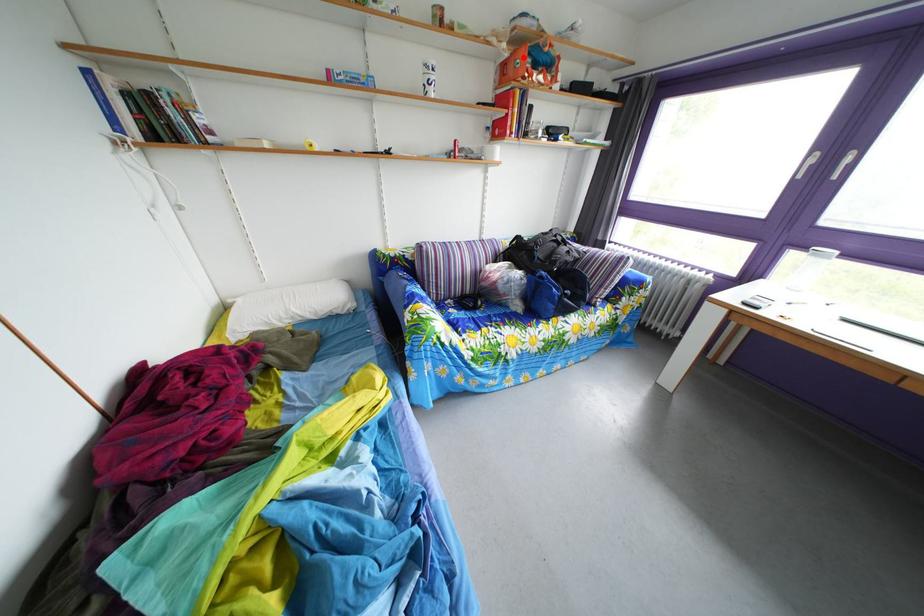
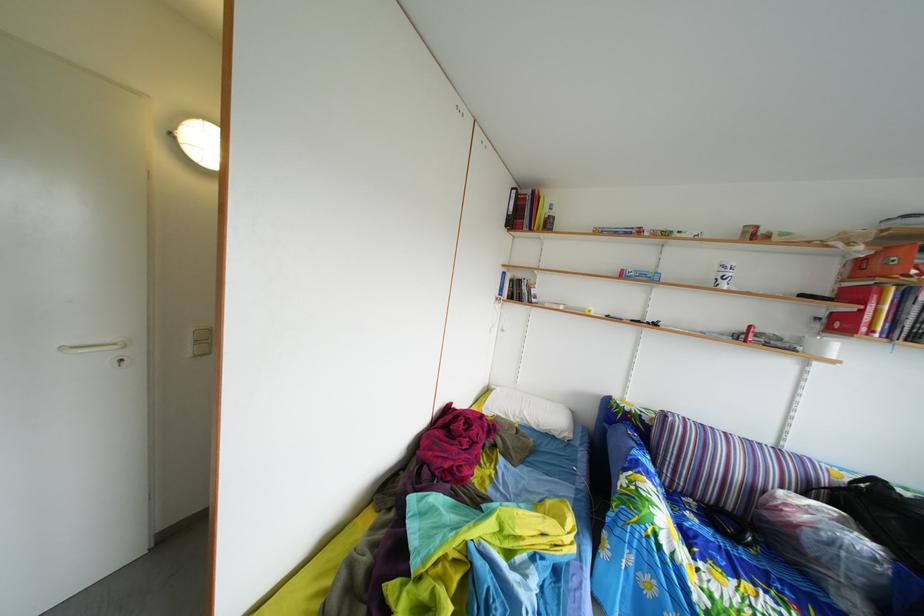
Question: I am providing you with two images of the same scene from different viewpoints. A red point is shown in image1. For the corresponding object point in image2, is it positioned nearer or farther from the camera?

Choices:
 (A) Nearer
 (B) Farther

Answer: (B)